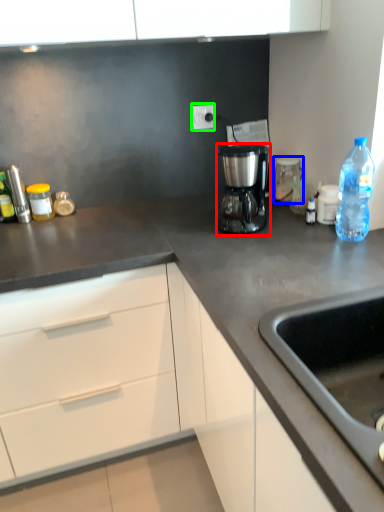
Question: Which is farther away from coffee maker (highlighted by a red box)? home appliance (highlighted by a blue box) or electric outlet (highlighted by a green box)?

Choices:
 (A) home appliance
 (B) electric outlet

Answer: (B)